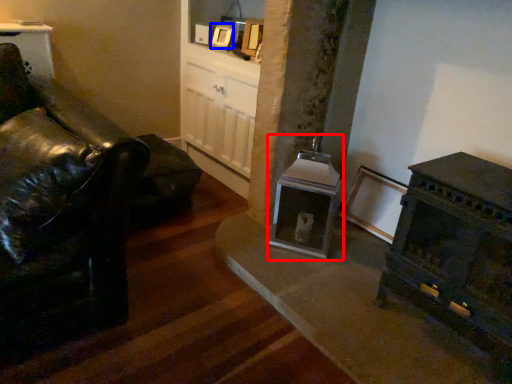
Question: Among these objects, which one is nearest to the camera, fireplace (highlighted by a red box) or picture frame (highlighted by a blue box)?

Choices:
 (A) fireplace
 (B) picture frame

Answer: (A)